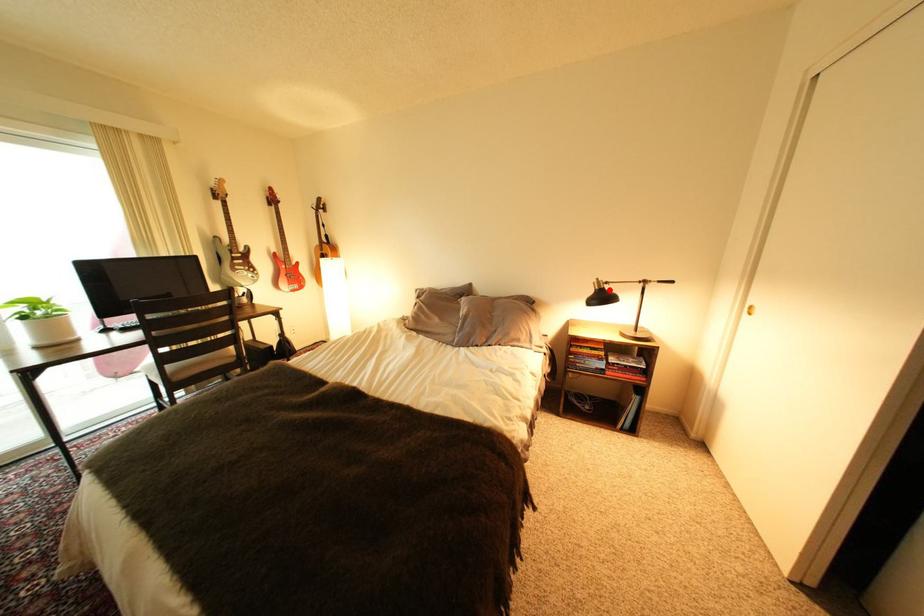
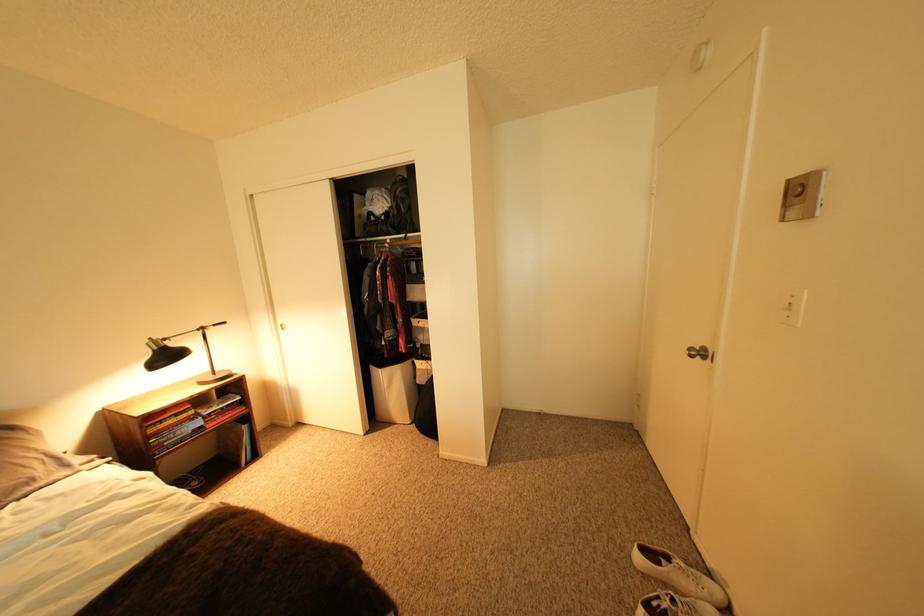
In the second image, find the point that corresponds to the highlighted location in the first image.

(168, 350)